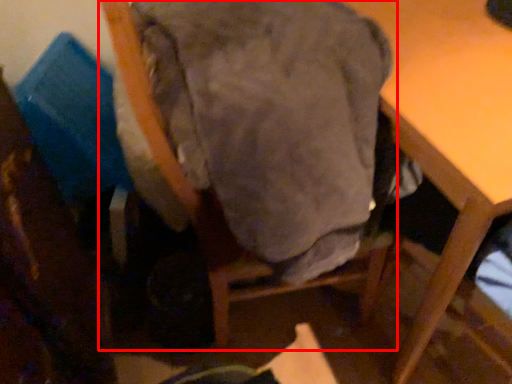
Question: Where is chair (annotated by the red box) located in relation to table in the image?

Choices:
 (A) left
 (B) right

Answer: (A)